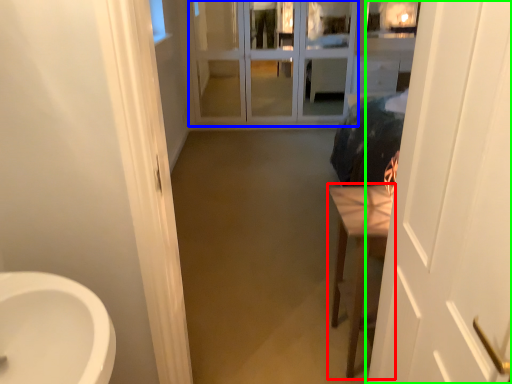
Question: Considering the real-world distances, which object is closest to furniture (highlighted by a red box)? screen door (highlighted by a blue box) or door (highlighted by a green box).

Choices:
 (A) screen door
 (B) door

Answer: (B)